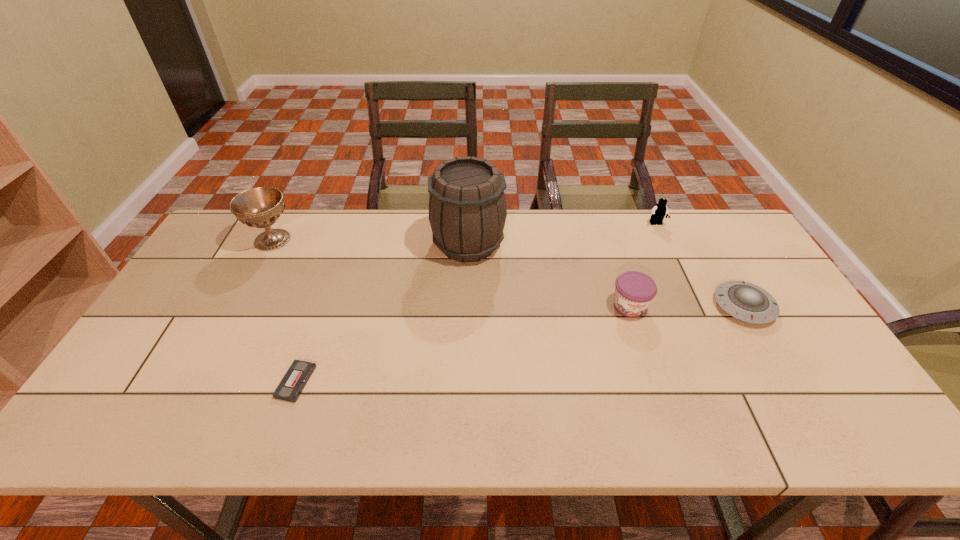
Identify the location of vacant space situated on the front of the tallest object. This screenshot has width=960, height=540. 466,342.

Where is `free space located on the right of the fifth shortest object`? This screenshot has height=540, width=960. free space located on the right of the fifth shortest object is located at coordinates (318, 240).

The image size is (960, 540). Identify the location of blank area located 0.090m on the front-facing side of the Lego. (665, 245).

Image resolution: width=960 pixels, height=540 pixels. Find the location of `free space located on the front label of the third object from right to left`. free space located on the front label of the third object from right to left is located at coordinates (660, 400).

Where is `free space located 0.080m on the left of the saucer`? free space located 0.080m on the left of the saucer is located at coordinates (685, 306).

This screenshot has width=960, height=540. Find the location of `free space located on the left of the shortest object`. free space located on the left of the shortest object is located at coordinates (201, 382).

I want to click on wine bucket positioned at the far edge, so click(467, 209).

The image size is (960, 540). I want to click on chalice that is at the far edge, so click(x=260, y=207).

The height and width of the screenshot is (540, 960). In order to click on Lego that is at the far edge in this screenshot , I will do `click(660, 210)`.

Identify the location of object located at the left edge. (260, 207).